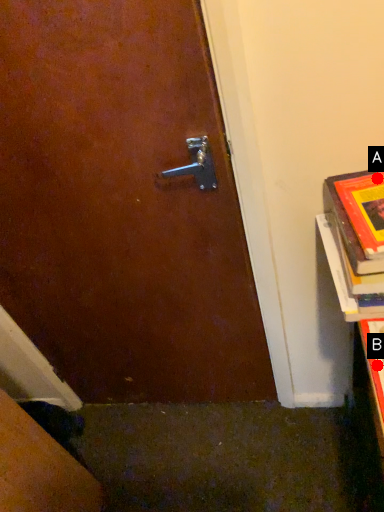
Question: Two points are circled on the image, labeled by A and B beside each circle. Which point is closer to the camera?

Choices:
 (A) A is closer
 (B) B is closer

Answer: (A)